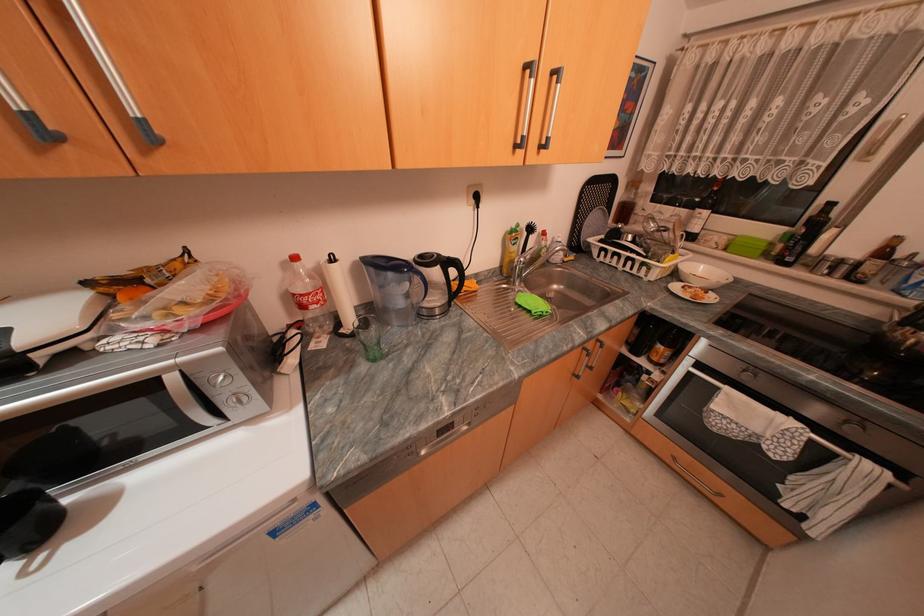
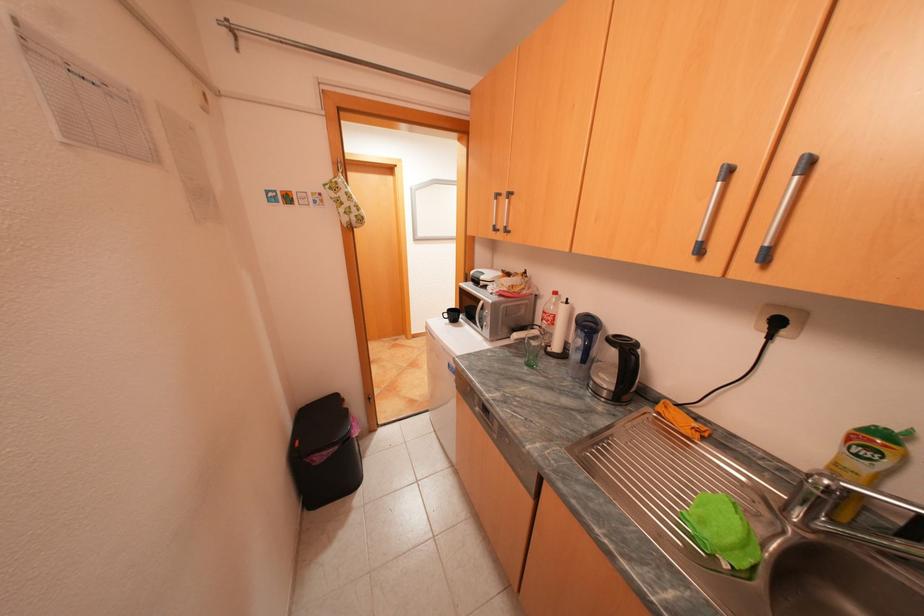
In the second image, find the point that corresponds to (372,366) in the first image.

(530, 360)